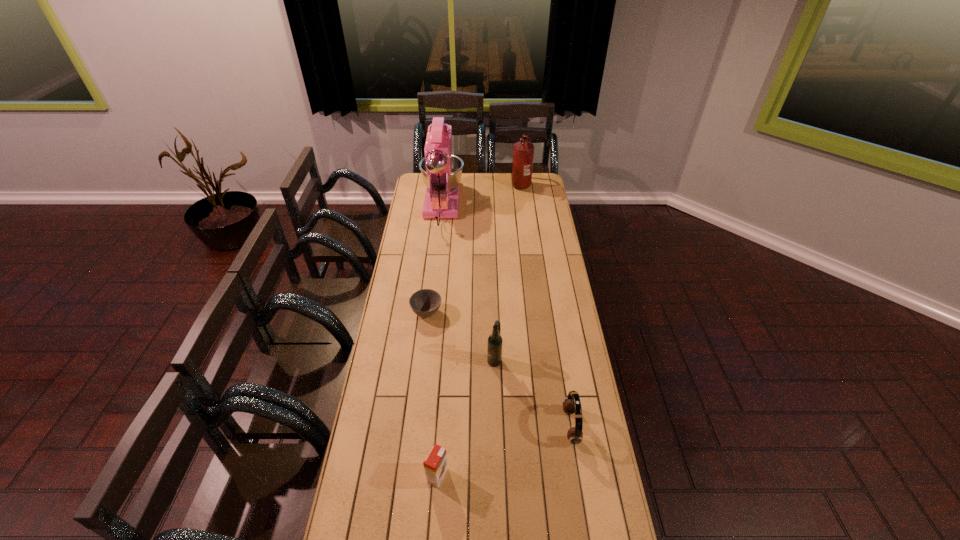
I want to click on vacant space located on the face of the mixer, so click(x=444, y=178).

Identify the location of vacant space located 0.070m at the front of the fire extinguisher where the nozzle is aimed. (500, 184).

At what (x,y) coordinates should I click in order to perform the action: click on free space located 0.240m at the front of the fire extinguisher where the nozzle is aimed. Please return your answer as a coordinate pair (x, y). Looking at the image, I should click on (474, 184).

This screenshot has width=960, height=540. I want to click on vacant point located at the front of the fire extinguisher where the nozzle is aimed, so click(452, 184).

Locate an element on the screen. The image size is (960, 540). vacant space located 0.380m on the front of the fourth farthest object is located at coordinates (497, 459).

You are a GUI agent. You are given a task and a screenshot of the screen. Output one action in this format:
    pyautogui.click(x=<x>, y=<y>)
    Task: Click on the free space located on the ear cup of the fifth farthest object
    The height and width of the screenshot is (540, 960).
    Given the screenshot: What is the action you would take?
    pyautogui.click(x=484, y=427)

You are a GUI agent. You are given a task and a screenshot of the screen. Output one action in this format:
    pyautogui.click(x=<x>, y=<y>)
    Task: Click on the free region located 0.360m on the ear cup of the fifth farthest object
    The height and width of the screenshot is (540, 960).
    Given the screenshot: What is the action you would take?
    pyautogui.click(x=465, y=427)

This screenshot has width=960, height=540. Identify the location of free space located 0.340m on the ear cup of the fifth farthest object. (470, 427).

Find the location of a particular element. This screenshot has height=540, width=960. vacant space situated on the back of the orange juice is located at coordinates (444, 379).

The width and height of the screenshot is (960, 540). What are the coordinates of `free space located 0.270m on the right of the bowl` in the screenshot? It's located at (502, 313).